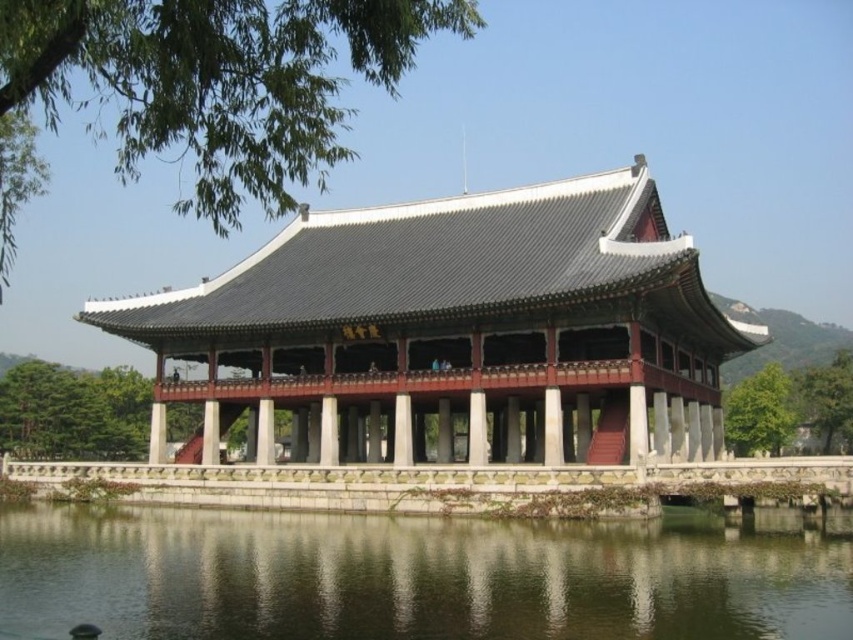
You are a visitor standing at the entrance of the palace complex. You see the matte gray stone palace at center and the transparent water at lower center. Which object is wider from your perspective?

The matte gray stone palace at center might be wider than transparent water at lower center according to the description.